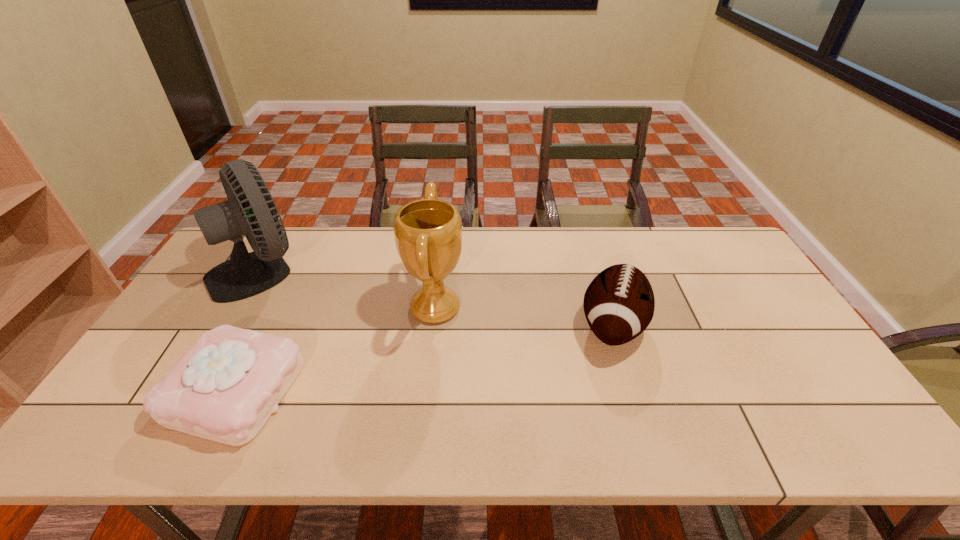
Identify the location of free point that satisfies the following two spatial constraints: 1. in front of the second shortest object to direct airflow; 2. on the left side of the fan. This screenshot has width=960, height=540. (227, 326).

Where is `free location that satisfies the following two spatial constraints: 1. on the front of the award with the decoration; 2. on the right side of the rightmost object`? Image resolution: width=960 pixels, height=540 pixels. free location that satisfies the following two spatial constraints: 1. on the front of the award with the decoration; 2. on the right side of the rightmost object is located at coordinates (433, 326).

Where is `vacant point that satisfies the following two spatial constraints: 1. in front of the cake to direct airflow; 2. on the right side of the fan`? This screenshot has width=960, height=540. vacant point that satisfies the following two spatial constraints: 1. in front of the cake to direct airflow; 2. on the right side of the fan is located at coordinates (189, 391).

Where is `free spot that satisfies the following two spatial constraints: 1. on the back side of the football (American); 2. on the left side of the cake`? free spot that satisfies the following two spatial constraints: 1. on the back side of the football (American); 2. on the left side of the cake is located at coordinates (268, 326).

What are the coordinates of `blank area in the image that satisfies the following two spatial constraints: 1. in front of the fan to direct airflow; 2. on the left side of the cake` in the screenshot? It's located at (189, 391).

Find the location of a particular element. This screenshot has height=540, width=960. vacant space that satisfies the following two spatial constraints: 1. in front of the cake to direct airflow; 2. on the right side of the fan is located at coordinates (189, 391).

The image size is (960, 540). Find the location of `free space that satisfies the following two spatial constraints: 1. in front of the shortest object to direct airflow; 2. on the right side of the fan`. free space that satisfies the following two spatial constraints: 1. in front of the shortest object to direct airflow; 2. on the right side of the fan is located at coordinates (189, 391).

This screenshot has width=960, height=540. In order to click on vacant space that satisfies the following two spatial constraints: 1. on the front of the award with the decoration; 2. on the right side of the third tallest object in this screenshot , I will do `click(433, 326)`.

Image resolution: width=960 pixels, height=540 pixels. Identify the location of vacant space that satisfies the following two spatial constraints: 1. in front of the fan to direct airflow; 2. on the back side of the football (American). (227, 326).

Identify the location of vacant point that satisfies the following two spatial constraints: 1. in front of the cake to direct airflow; 2. on the right side of the fan. (189, 391).